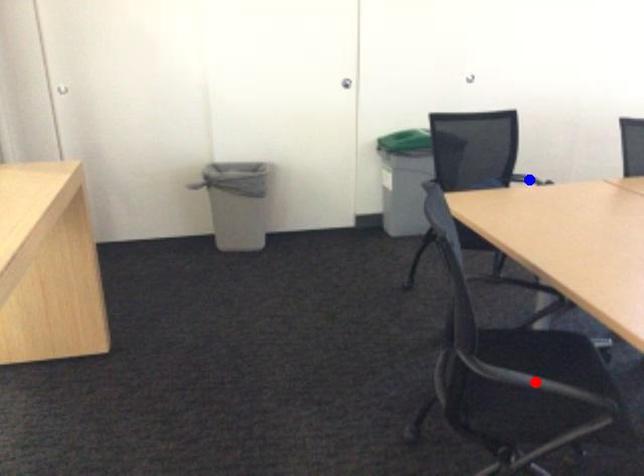
Question: Which of the two points in the image is closer to the camera?

Choices:
 (A) Blue point is closer.
 (B) Red point is closer.

Answer: (B)